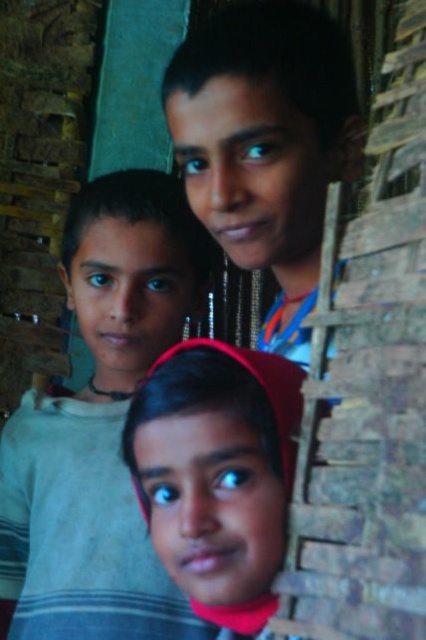
Is point (16, 512) positioned behind point (279, 378)?

Yes.

Is point (181, 637) in front of point (210, 346)?

No, it is not.

Between point (89, 337) and point (282, 388), which one is positioned in front?

Point (282, 388) is in front.

The height and width of the screenshot is (640, 426). Identify the location of light gray striped shirt at center. (100, 424).

Between point (80, 451) and point (294, 289), which one is positioned in front?

Point (294, 289) is more forward.

Is light gray striped shirt at center wider than smooth skin face at center?

Correct, the width of light gray striped shirt at center exceeds that of smooth skin face at center.

Locate an element on the screen. light gray striped shirt at center is located at coordinates (100, 424).

Who is positioned more to the left, smooth skin face at center or pink fabric headscarf at center?

pink fabric headscarf at center is more to the left.

Does smooth skin face at center have a lesser width compared to pink fabric headscarf at center?

No.

You are a GUI agent. You are given a task and a screenshot of the screen. Output one action in this format:
    pyautogui.click(x=<x>, y=<y>)
    Task: Click on the smooth skin face at center
    
    Given the screenshot: What is the action you would take?
    pyautogui.click(x=265, y=144)

This screenshot has height=640, width=426. Identify the location of smooth skin face at center. (265, 144).